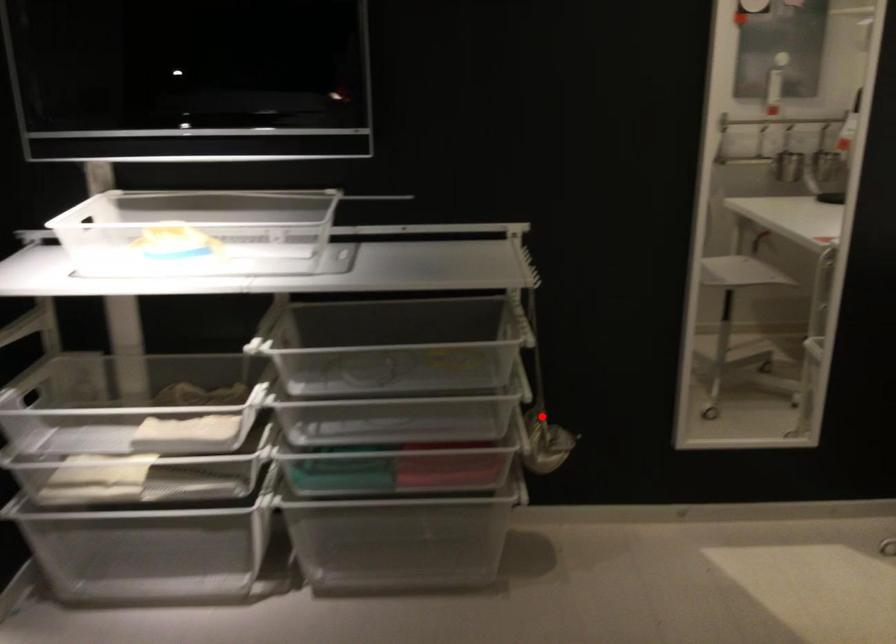
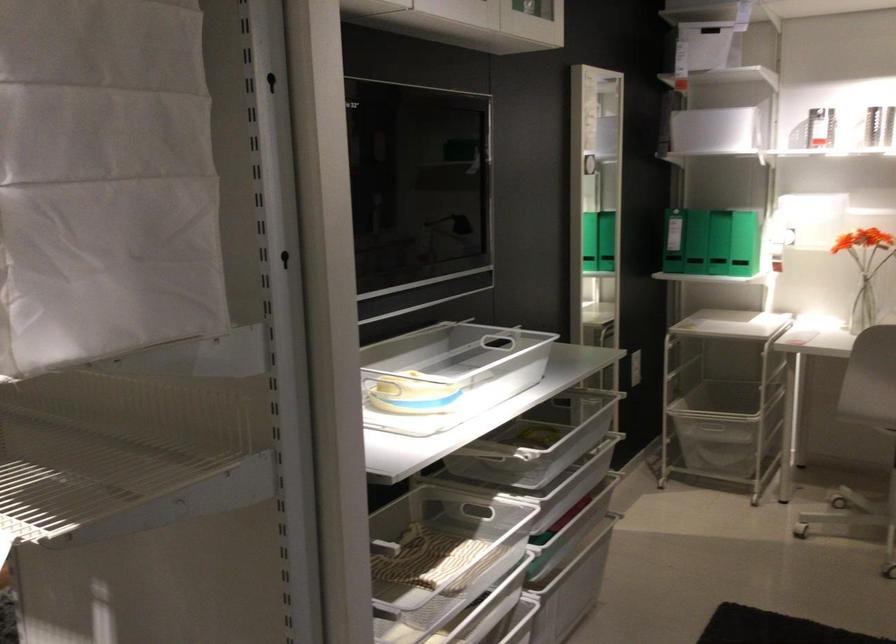
Question: I am providing you with two images of the same scene from different viewpoints. A red point is marked on the first image. Is the red point's position out of view in image 2?

Choices:
 (A) Yes
 (B) No

Answer: (A)